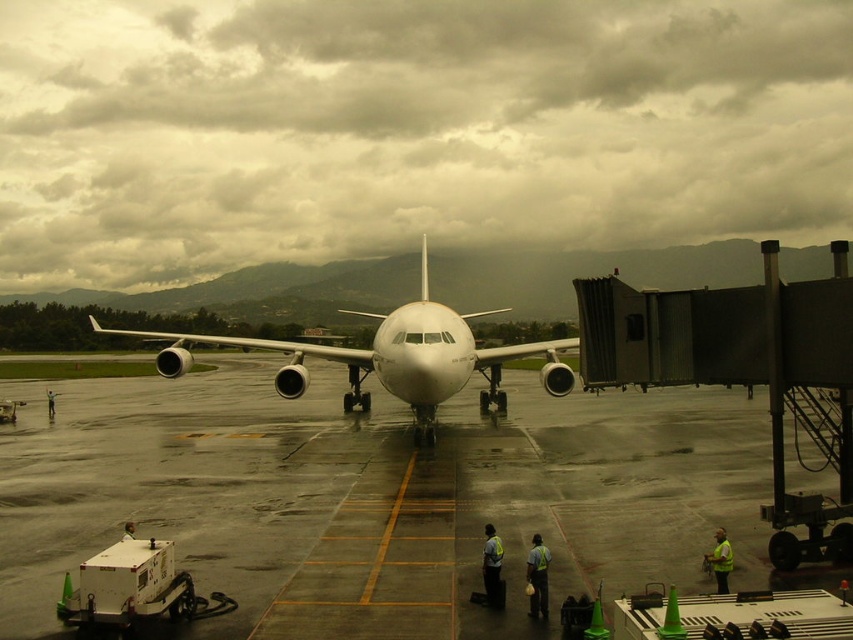
Question: Does reflective yellow vest at center have a larger size compared to green reflective vest at center?

Choices:
 (A) yes
 (B) no

Answer: (A)

Question: Can you confirm if white glossy airplane at center is thinner than reflective safety vest at center?

Choices:
 (A) no
 (B) yes

Answer: (A)

Question: Which point appears closest to the camera in this image?

Choices:
 (A) (492, 538)
 (B) (125, 525)
 (C) (566, 378)
 (D) (49, 406)

Answer: (A)

Question: Estimate the real-world distances between objects in this image. Which object is closer to the reflective safety vest at center?

Choices:
 (A) yellow reflective vest at lower right
 (B) white glossy airplane at center
 (C) reflective yellow vest at center
 (D) smooth concrete tarmac at center

Answer: (C)

Question: Which of these objects is positioned farthest from the smooth concrete tarmac at center?

Choices:
 (A) reflective yellow vest at center
 (B) yellow reflective vest at lower right
 (C) white glossy airplane at center
 (D) reflective safety vest at center

Answer: (B)

Question: Does reflective safety vest at center appear on the right side of green reflective vest at center?

Choices:
 (A) no
 (B) yes

Answer: (B)